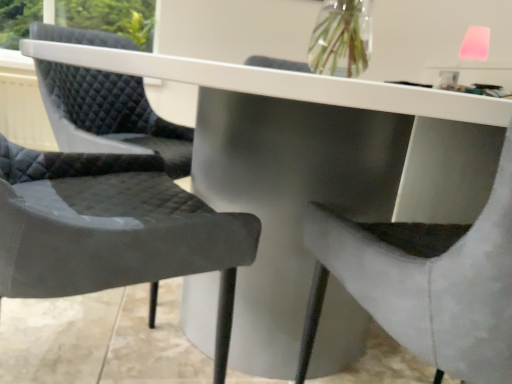
Question: Visually, is suede-like gray chair at center, the 2th chair when ordered from left to right, positioned to the left or to the right of matte black chair at center, arranged as the 1th chair when viewed from the left?

Choices:
 (A) left
 (B) right

Answer: (B)

Question: From the image's perspective, is suede-like gray chair at center, arranged as the first chair when viewed from the right, located above or below matte black chair at center, acting as the second chair starting from the right?

Choices:
 (A) above
 (B) below

Answer: (B)

Question: In terms of size, does suede-like gray chair at center, the 2th chair when ordered from left to right, appear bigger or smaller than matte black chair at center, arranged as the 1th chair when viewed from the left?

Choices:
 (A) small
 (B) big

Answer: (B)

Question: Is matte black chair at center, acting as the second chair starting from the right, situated inside suede-like gray chair at center, arranged as the first chair when viewed from the right, or outside?

Choices:
 (A) outside
 (B) inside

Answer: (A)

Question: Relative to suede-like gray chair at center, arranged as the first chair when viewed from the right, is matte black chair at center, acting as the second chair starting from the right, in front or behind?

Choices:
 (A) front
 (B) behind

Answer: (B)

Question: Is matte black chair at center, arranged as the 1th chair when viewed from the left, wider or thinner than suede-like gray chair at center, the 2th chair when ordered from left to right?

Choices:
 (A) thin
 (B) wide

Answer: (A)

Question: Considering the positions of point (42, 230) and point (501, 319), is point (42, 230) closer or farther from the camera than point (501, 319)?

Choices:
 (A) farther
 (B) closer

Answer: (A)